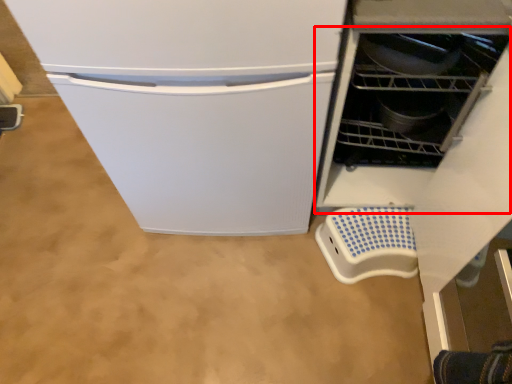
Question: Observing the image, what is the correct spatial positioning of dish washer (annotated by the red box) in reference to appliance?

Choices:
 (A) right
 (B) left

Answer: (B)